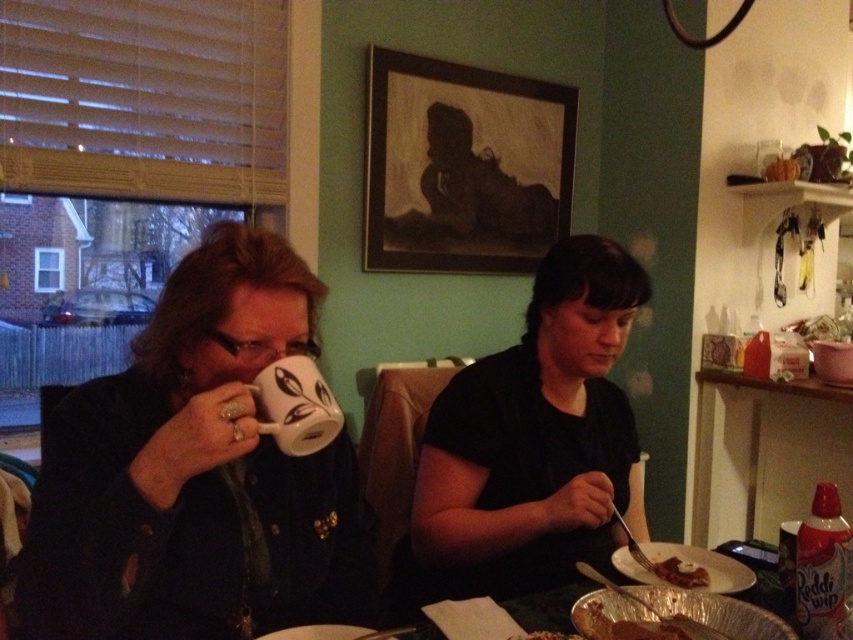
You are a photographer trying to capture the black matte shirt at center and the white glossy mug at upper center in the same frame. Based on their positions, which object should you focus on first to ensure both are in focus?

The black matte shirt at center is positioned under the white glossy mug at upper center, so you should focus on the white glossy mug at upper center first to ensure both are in focus since it is closer to the camera.

Consider the image. You are a food critic evaluating the presentation of the dishes in this image. Which object, the red matte whipped cream at lower right or the shiny silver fork at lower right, has a smaller width?

The red matte whipped cream at lower right is thinner than the shiny silver fork at lower right, so the red matte whipped cream at lower right has a smaller width.

You are a food delivery person who just arrived at this dining scene. You need to place a new dessert order on the table. The dessert comes with a red matte whipped cream at lower right. Where should you place it relative to the metallic silver tray at right?

The metallic silver tray at right is positioned on the right side of the red matte whipped cream at lower right, so you should place the dessert with the red matte whipped cream at lower right to the left of the metallic silver tray at right.